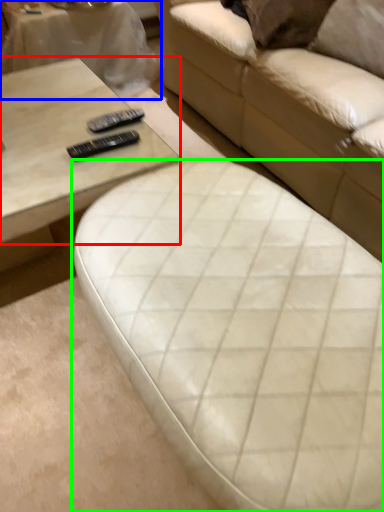
Question: Estimate the real-world distances between objects in this image. Which object is closer to coffee table (highlighted by a red box), table (highlighted by a blue box) or studio couch (highlighted by a green box)?

Choices:
 (A) table
 (B) studio couch

Answer: (B)